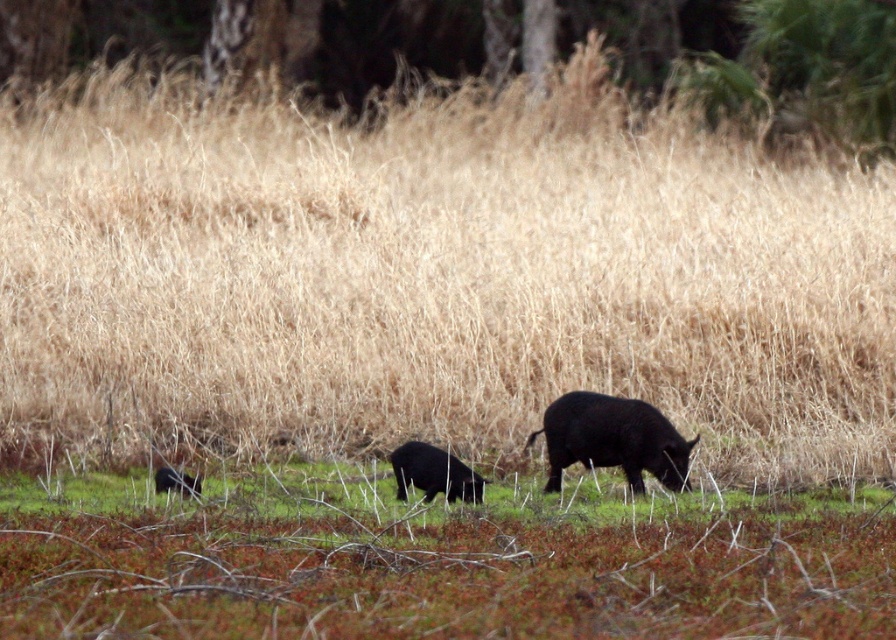
You are a photographer trying to capture both the black matte pig at center and the shiny black bear at lower left in a single shot. Based on their positions, which animal is closer to the camera?

The black matte pig at center is positioned under the shiny black bear at lower left, meaning the shiny black bear at lower left is closer to the camera.